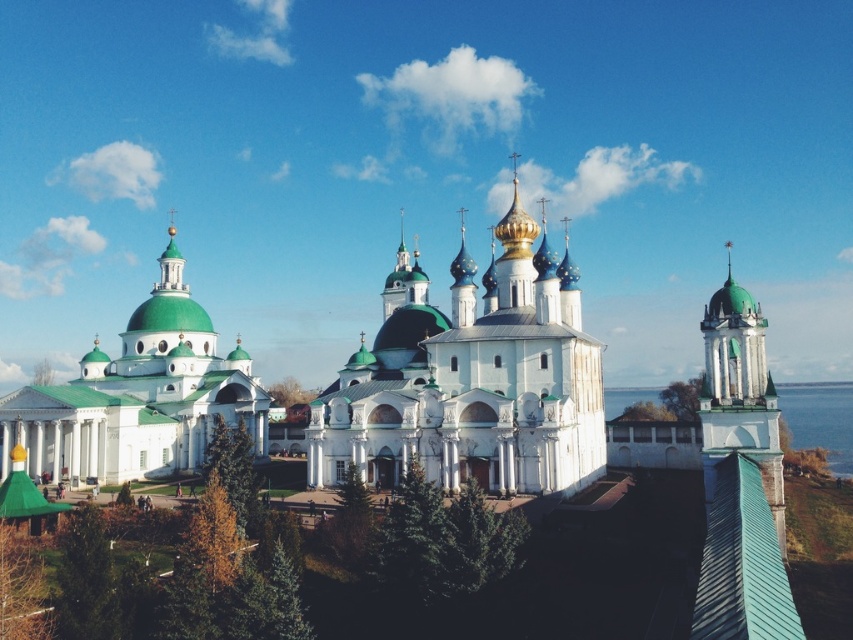
Question: Which point is farther from the camera taking this photo?

Choices:
 (A) (718, 328)
 (B) (833, 449)

Answer: (B)

Question: Can you confirm if white glossy church at left is positioned below blue water at tower right?

Choices:
 (A) yes
 (B) no

Answer: (B)

Question: Does white glossy church at left appear on the right side of blue water at tower right?

Choices:
 (A) no
 (B) yes

Answer: (A)

Question: Which of the following is the closest to the observer?

Choices:
 (A) (49, 410)
 (B) (717, 342)
 (C) (804, 433)
 (D) (424, 340)

Answer: (B)

Question: Which object is farther from the camera taking this photo?

Choices:
 (A) green glazed tower at right
 (B) blue water at tower right
 (C) white stone church at center
 (D) white glossy church at left

Answer: (B)

Question: Can you confirm if white glossy church at left is thinner than green glazed tower at right?

Choices:
 (A) no
 (B) yes

Answer: (B)